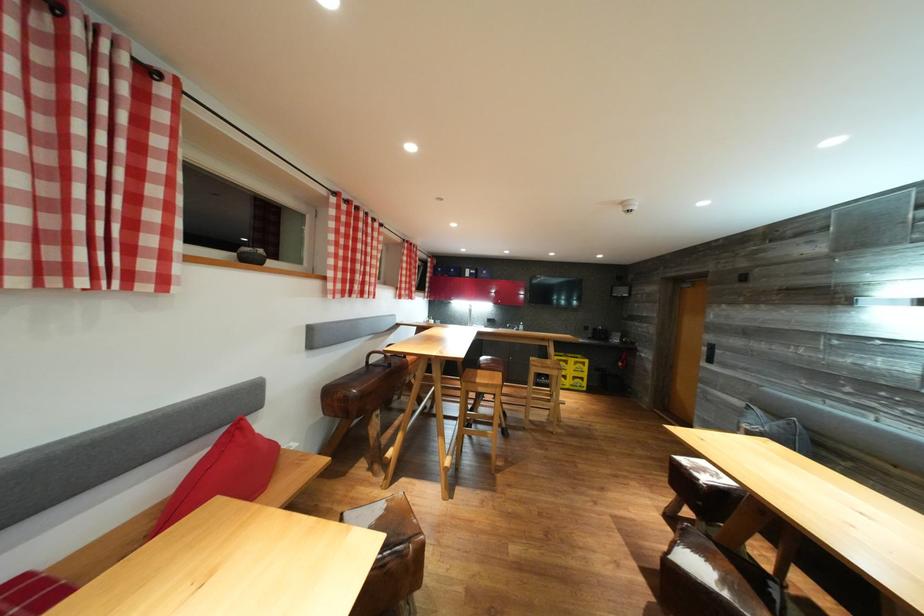
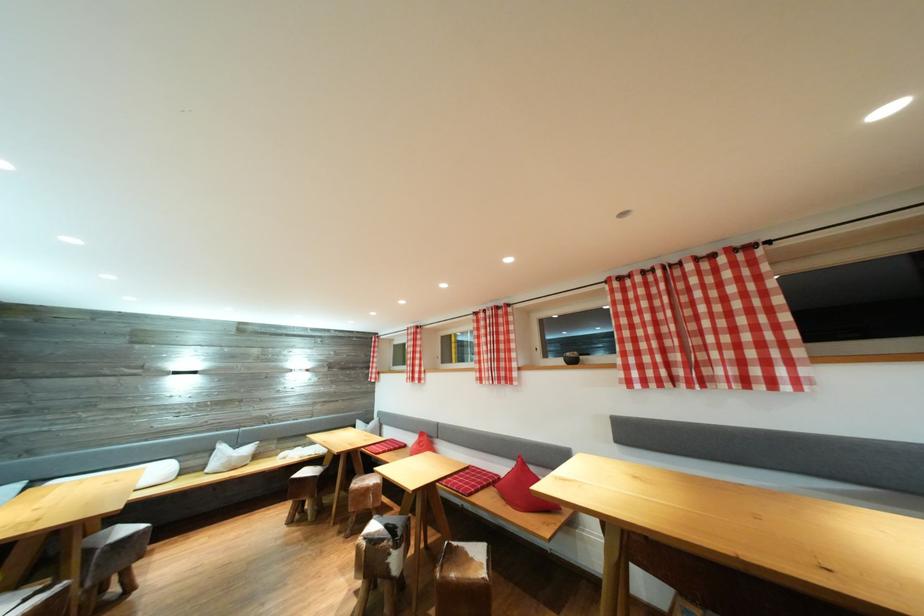
Locate, in the second image, the point that corresponds to [351,201] in the first image.

(631, 278)